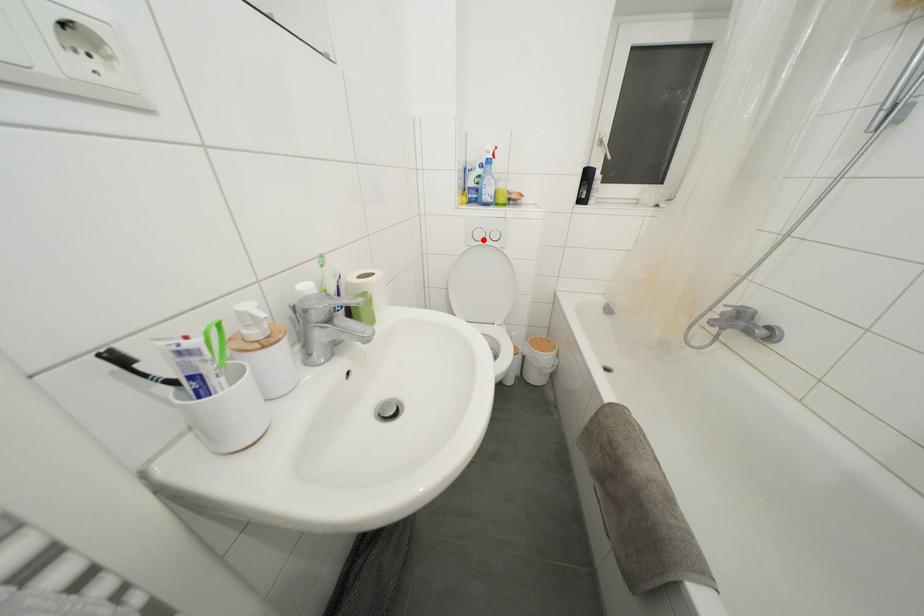
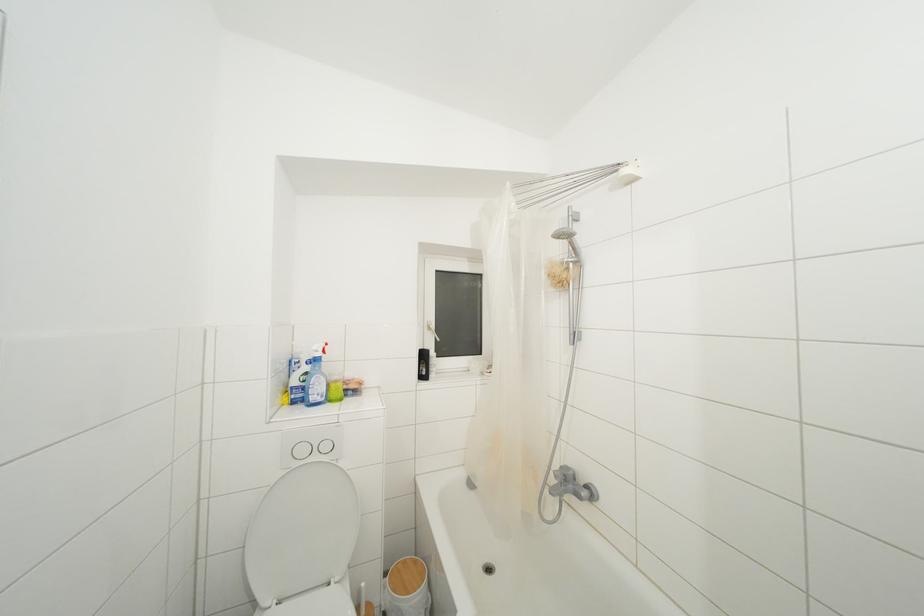
Locate, in the second image, the point that corresponds to the highlighted location in the first image.

(307, 456)